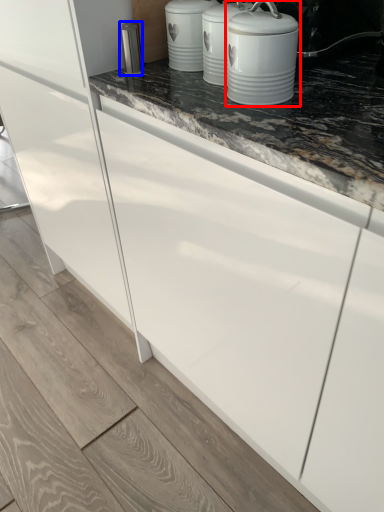
Question: Which object appears closest to the camera in this image, home appliance (highlighted by a red box) or appliance (highlighted by a blue box)?

Choices:
 (A) home appliance
 (B) appliance

Answer: (A)